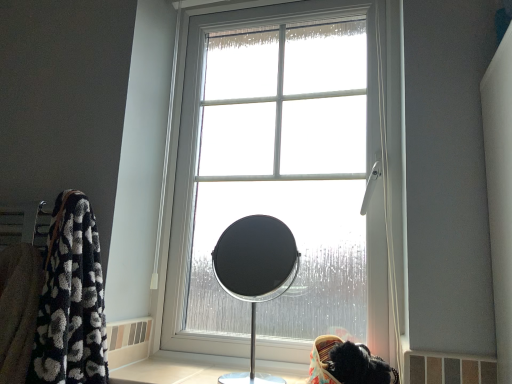
Question: Considering the relative positions of matte black mirror at center and clear glass window at center in the image provided, is matte black mirror at center behind clear glass window at center?

Choices:
 (A) no
 (B) yes

Answer: (A)

Question: Considering the relative sizes of matte black mirror at center and clear glass window at center in the image provided, is matte black mirror at center bigger than clear glass window at center?

Choices:
 (A) no
 (B) yes

Answer: (A)

Question: Is clear glass window at center completely or partially inside matte black mirror at center?

Choices:
 (A) yes
 (B) no

Answer: (B)

Question: Is matte black mirror at center wider than clear glass window at center?

Choices:
 (A) yes
 (B) no

Answer: (A)

Question: Does matte black mirror at center have a lesser height compared to clear glass window at center?

Choices:
 (A) yes
 (B) no

Answer: (A)

Question: Is matte black mirror at center at the right side of clear glass window at center?

Choices:
 (A) yes
 (B) no

Answer: (B)

Question: Can you see clear glass window at center touching matte black mirror at center?

Choices:
 (A) yes
 (B) no

Answer: (B)

Question: Can you confirm if clear glass window at center is wider than matte black mirror at center?

Choices:
 (A) yes
 (B) no

Answer: (B)

Question: Does clear glass window at center lie in front of matte black mirror at center?

Choices:
 (A) no
 (B) yes

Answer: (A)

Question: Considering the relative positions of clear glass window at center and matte black mirror at center in the image provided, is clear glass window at center to the left of matte black mirror at center from the viewer's perspective?

Choices:
 (A) no
 (B) yes

Answer: (A)

Question: Does clear glass window at center have a lesser width compared to matte black mirror at center?

Choices:
 (A) yes
 (B) no

Answer: (A)

Question: Is clear glass window at center shorter than matte black mirror at center?

Choices:
 (A) yes
 (B) no

Answer: (B)

Question: From the image's perspective, is matte black mirror at center above or below clear glass window at center?

Choices:
 (A) below
 (B) above

Answer: (A)